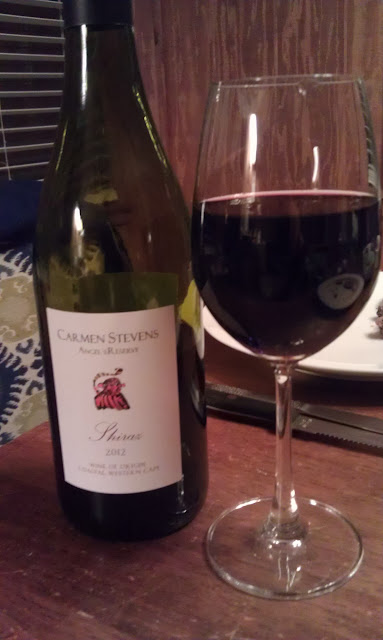
Locate an element on the screen. This screenshot has width=383, height=640. glass stem is located at coordinates (284, 442).